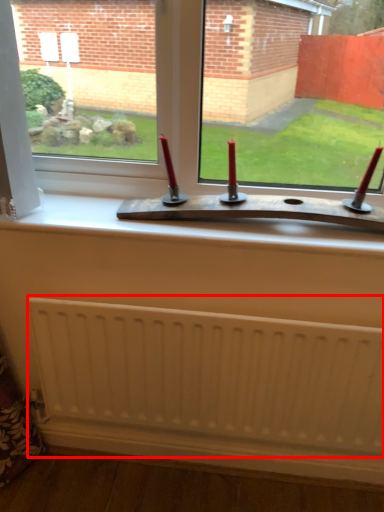
Question: From the image, what is the correct spatial relationship of radiator (annotated by the red box) in relation to window?

Choices:
 (A) right
 (B) left

Answer: (A)